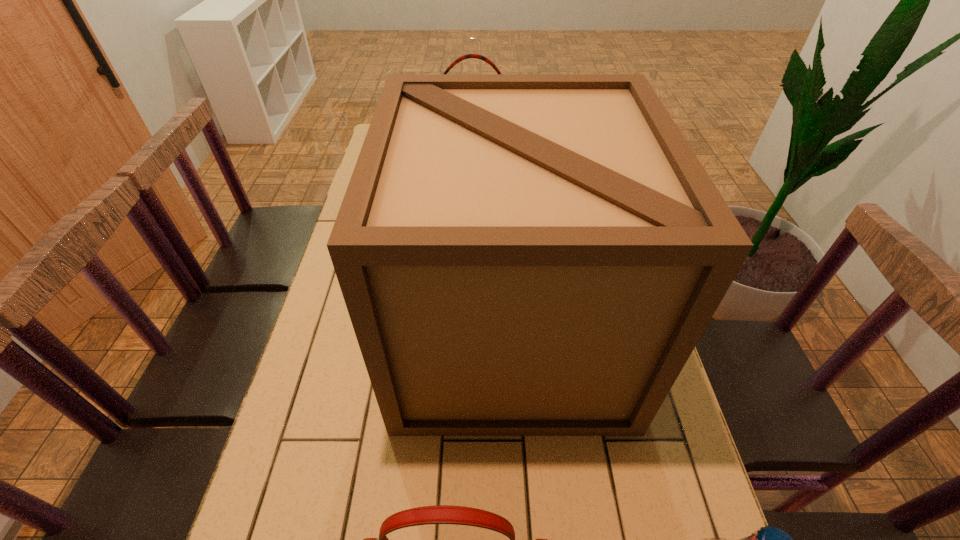
At what (x,y) coordinates should I click in order to perform the action: click on the second farthest object. Please return your answer as a coordinate pair (x, y). Looking at the image, I should click on (520, 254).

The height and width of the screenshot is (540, 960). What are the coordinates of `the tallest object` in the screenshot? It's located at (520, 254).

Where is `the farthest object`? The height and width of the screenshot is (540, 960). the farthest object is located at coordinates (467, 56).

I want to click on vacant space situated 0.200m on the reinforced sides of the box, so click(323, 333).

I want to click on free space located on the reinforced sides of the box, so click(x=372, y=333).

Where is `vacant region located on the reinforced sides of the box`? The width and height of the screenshot is (960, 540). vacant region located on the reinforced sides of the box is located at coordinates (368, 333).

Locate an element on the screen. This screenshot has height=540, width=960. vacant point located 0.080m on the handle side of the farthest object is located at coordinates (473, 211).

The width and height of the screenshot is (960, 540). In order to click on object present at the far edge in this screenshot , I will do `click(467, 56)`.

Where is `object present at the right edge`? The image size is (960, 540). object present at the right edge is located at coordinates (520, 254).

Where is `vacant space at the right edge of the desktop`? The image size is (960, 540). vacant space at the right edge of the desktop is located at coordinates (675, 475).